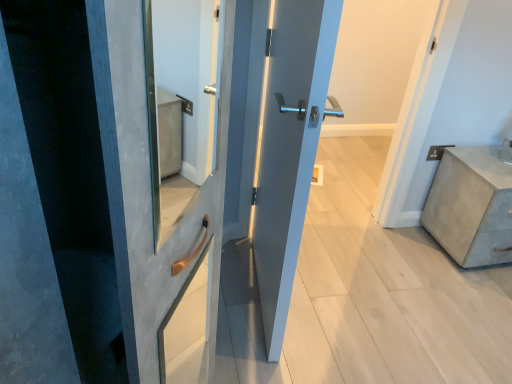
Question: Is concrete textured chest of drawers at right not close to satin blue door at center?

Choices:
 (A) yes
 (B) no

Answer: (A)

Question: Does concrete textured chest of drawers at right turn towards satin blue door at center?

Choices:
 (A) yes
 (B) no

Answer: (B)

Question: Could satin blue door at center be considered to be inside concrete textured chest of drawers at right?

Choices:
 (A) no
 (B) yes

Answer: (A)

Question: Does concrete textured chest of drawers at right have a lesser height compared to satin blue door at center?

Choices:
 (A) no
 (B) yes

Answer: (B)

Question: Is concrete textured chest of drawers at right positioned with its back to satin blue door at center?

Choices:
 (A) no
 (B) yes

Answer: (A)

Question: Is concrete textured chest of drawers at right bigger than satin blue door at center?

Choices:
 (A) yes
 (B) no

Answer: (A)

Question: From the image's perspective, is satin blue door at center below concrete textured chest of drawers at right?

Choices:
 (A) yes
 (B) no

Answer: (B)

Question: Is the surface of satin blue door at center in direct contact with concrete textured chest of drawers at right?

Choices:
 (A) yes
 (B) no

Answer: (B)

Question: Is satin blue door at center turned away from concrete textured chest of drawers at right?

Choices:
 (A) no
 (B) yes

Answer: (A)

Question: Can you confirm if satin blue door at center is wider than concrete textured chest of drawers at right?

Choices:
 (A) no
 (B) yes

Answer: (A)

Question: Is satin blue door at center thinner than concrete textured chest of drawers at right?

Choices:
 (A) no
 (B) yes

Answer: (B)

Question: Does satin blue door at center appear on the right side of concrete textured chest of drawers at right?

Choices:
 (A) yes
 (B) no

Answer: (B)

Question: Based on their positions, is satin blue door at center located to the left or right of concrete textured chest of drawers at right?

Choices:
 (A) left
 (B) right

Answer: (A)